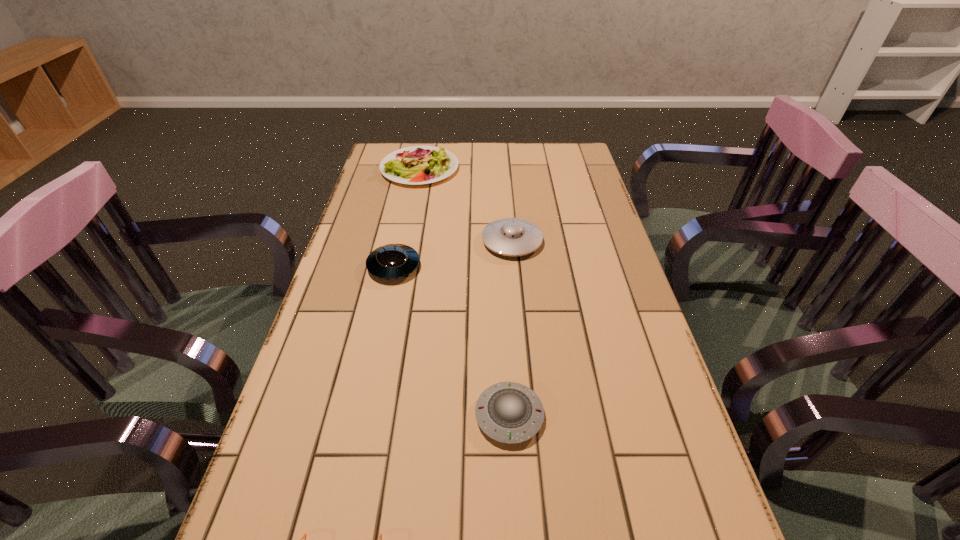
You are a GUI agent. You are given a task and a screenshot of the screen. Output one action in this format:
    pyautogui.click(x=<x>, y=<y>)
    Task: Click on the salad plate
    This screenshot has width=960, height=540.
    Given the screenshot: What is the action you would take?
    pyautogui.click(x=414, y=165)

Find the location of `the leftmost saucer`. the leftmost saucer is located at coordinates (393, 261).

The height and width of the screenshot is (540, 960). What are the coordinates of `the second shortest saucer` in the screenshot? It's located at (393, 261).

Where is `the nearest saucer`? Image resolution: width=960 pixels, height=540 pixels. the nearest saucer is located at coordinates (508, 412).

You are a GUI agent. You are given a task and a screenshot of the screen. Output one action in this format:
    pyautogui.click(x=<x>, y=<y>)
    Task: Click on the shortest saucer
    Image resolution: width=960 pixels, height=540 pixels.
    Given the screenshot: What is the action you would take?
    pyautogui.click(x=508, y=412)

Where is `vacant space located on the right of the salad plate`? The image size is (960, 540). vacant space located on the right of the salad plate is located at coordinates (519, 168).

This screenshot has width=960, height=540. I want to click on free region located on the back of the third tallest object, so click(x=411, y=187).

Find the location of a particular element. The width and height of the screenshot is (960, 540). free space located 0.210m on the left of the second nearest object is located at coordinates (371, 415).

This screenshot has width=960, height=540. I want to click on object situated at the far edge, so click(x=414, y=165).

Identify the location of salad plate situated at the left edge. Image resolution: width=960 pixels, height=540 pixels. (414, 165).